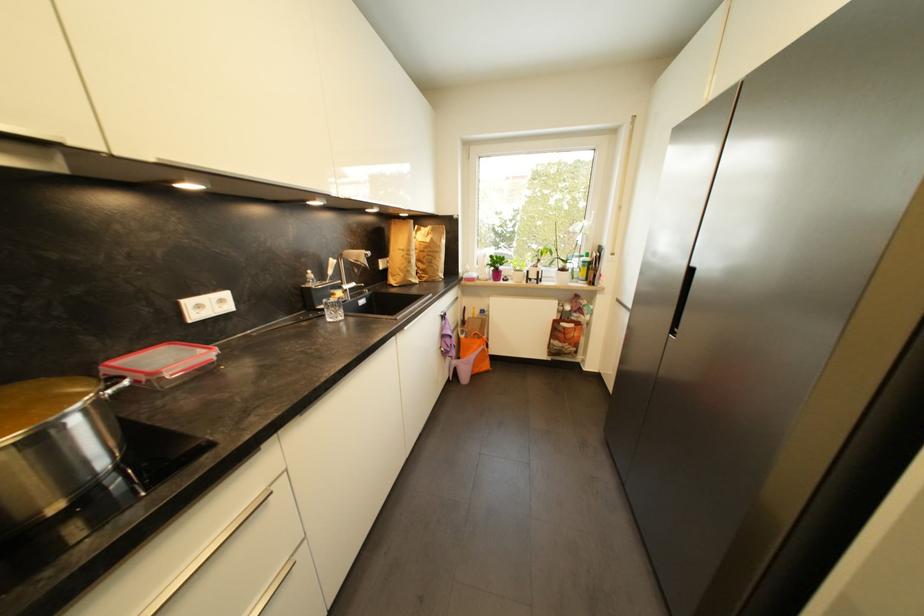
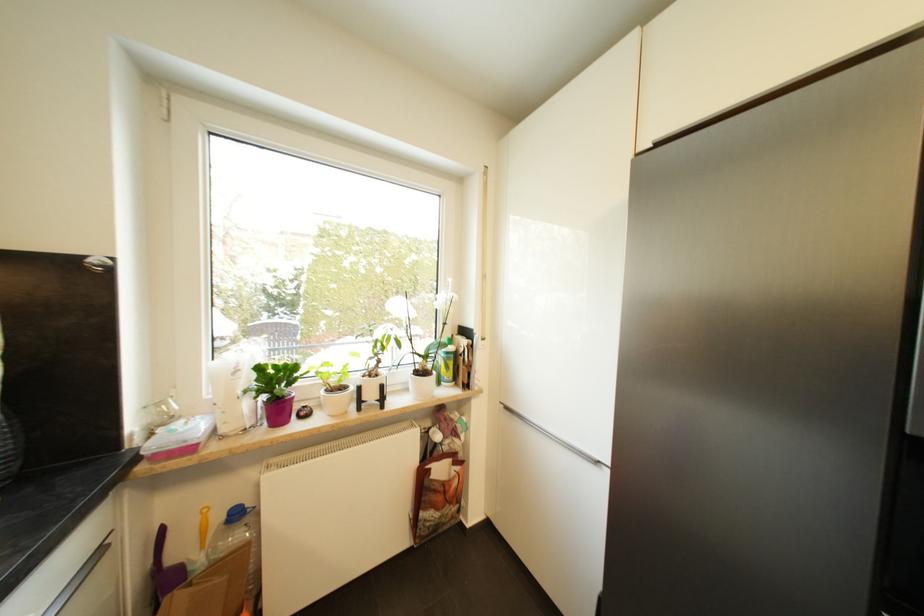
In the second image, find the point that corresponds to the point at 623,302 in the first image.

(512, 410)